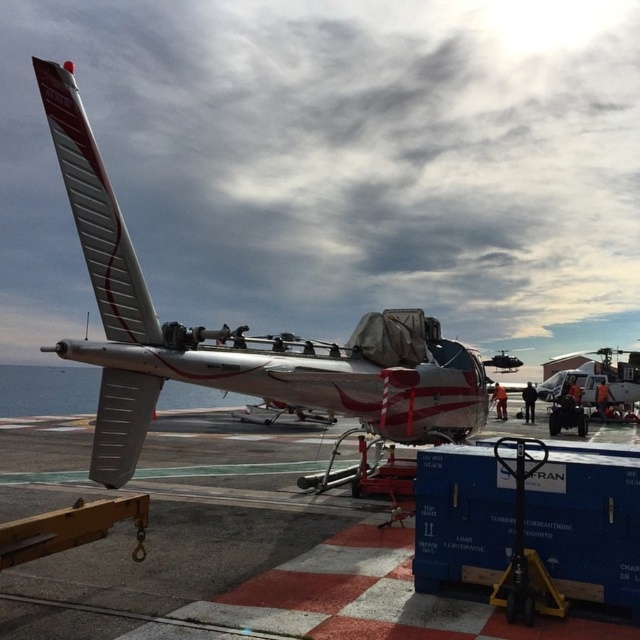
Question: Can you confirm if smooth concrete tarmac at center is positioned to the right of silver metallic airplane at center?

Choices:
 (A) no
 (B) yes

Answer: (A)

Question: In this image, where is smooth concrete tarmac at center located relative to silver metallic airplane at center?

Choices:
 (A) above
 (B) below

Answer: (B)

Question: Which point is closer to the camera?

Choices:
 (A) (116, 554)
 (B) (144, 304)

Answer: (A)

Question: Is smooth concrete tarmac at center to the left of silver metallic airplane at center from the viewer's perspective?

Choices:
 (A) no
 (B) yes

Answer: (B)